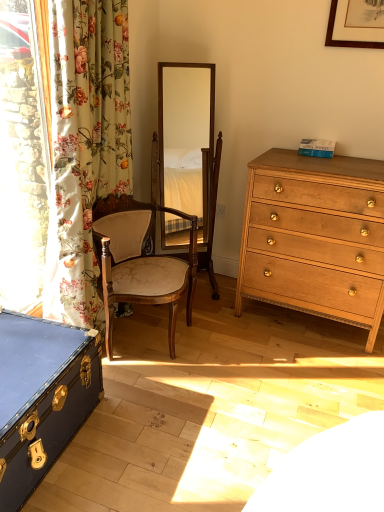
Question: From a real-world perspective, is white plastic power outlet at center under floral fabric curtain at left?

Choices:
 (A) no
 (B) yes

Answer: (B)

Question: Considering the relative positions of white plastic power outlet at center and floral fabric curtain at left in the image provided, is white plastic power outlet at center behind floral fabric curtain at left?

Choices:
 (A) yes
 (B) no

Answer: (A)

Question: Is white plastic power outlet at center closer to camera compared to floral fabric curtain at left?

Choices:
 (A) no
 (B) yes

Answer: (A)

Question: Can you confirm if white plastic power outlet at center is smaller than floral fabric curtain at left?

Choices:
 (A) yes
 (B) no

Answer: (A)

Question: From the image's perspective, does white plastic power outlet at center appear higher than floral fabric curtain at left?

Choices:
 (A) no
 (B) yes

Answer: (A)

Question: Is blue leather trunk at lower left taller or shorter than floral fabric curtain at left?

Choices:
 (A) tall
 (B) short

Answer: (B)

Question: In terms of size, does blue leather trunk at lower left appear bigger or smaller than floral fabric curtain at left?

Choices:
 (A) big
 (B) small

Answer: (B)

Question: Looking at their shapes, would you say blue leather trunk at lower left is wider or thinner than floral fabric curtain at left?

Choices:
 (A) thin
 (B) wide

Answer: (B)

Question: From a real-world perspective, is blue leather trunk at lower left above or below floral fabric curtain at left?

Choices:
 (A) above
 (B) below

Answer: (B)

Question: Considering the positions of floral fabric curtain at left and light brown wooden chest of drawers at right in the image, is floral fabric curtain at left bigger or smaller than light brown wooden chest of drawers at right?

Choices:
 (A) small
 (B) big

Answer: (A)

Question: Relative to light brown wooden chest of drawers at right, is floral fabric curtain at left in front or behind?

Choices:
 (A) behind
 (B) front

Answer: (B)

Question: In terms of width, does floral fabric curtain at left look wider or thinner when compared to light brown wooden chest of drawers at right?

Choices:
 (A) wide
 (B) thin

Answer: (B)

Question: From the image's perspective, is floral fabric curtain at left above or below light brown wooden chest of drawers at right?

Choices:
 (A) below
 (B) above

Answer: (B)

Question: From their relative heights in the image, would you say wooden upholstered chair at center is taller or shorter than light brown wooden chest of drawers at right?

Choices:
 (A) short
 (B) tall

Answer: (A)

Question: From a real-world perspective, is wooden upholstered chair at center positioned above or below light brown wooden chest of drawers at right?

Choices:
 (A) above
 (B) below

Answer: (B)